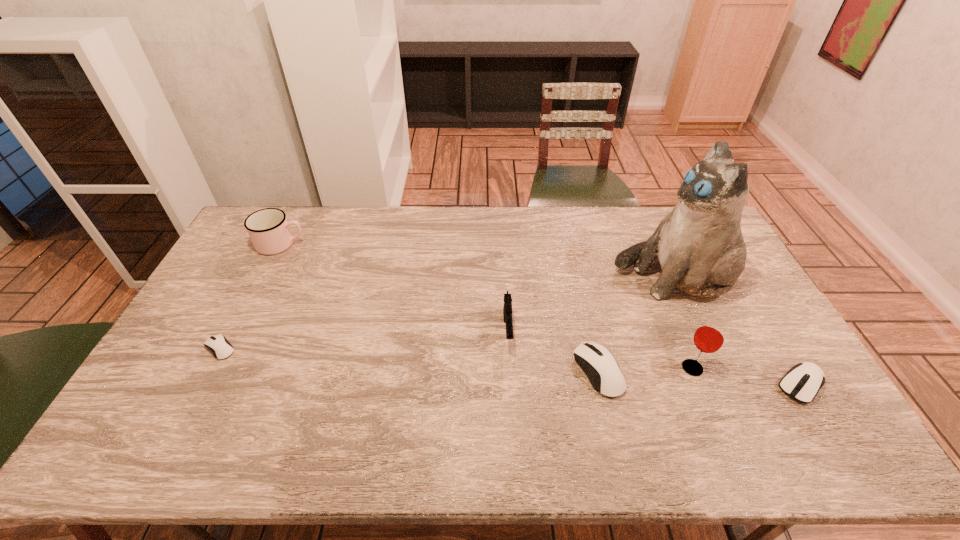
Where is `empty space that is in between the rightmost mouse and the fourth object from left to right`? The height and width of the screenshot is (540, 960). empty space that is in between the rightmost mouse and the fourth object from left to right is located at coordinates (700, 379).

Where is `free point between the second shortest object and the tallest object`? free point between the second shortest object and the tallest object is located at coordinates (737, 330).

The height and width of the screenshot is (540, 960). I want to click on vacant area that lies between the second mouse from right to left and the third object from left to right, so click(553, 352).

Identify the location of free spot between the second mouse from right to left and the sixth shortest object. Image resolution: width=960 pixels, height=540 pixels. (645, 370).

Where is `free space between the second shortest mouse and the shortest object`? free space between the second shortest mouse and the shortest object is located at coordinates (511, 367).

Where is `free space between the glass and the second tallest mouse`? free space between the glass and the second tallest mouse is located at coordinates (747, 376).

The width and height of the screenshot is (960, 540). What are the coordinates of `free area in between the fourth object from left to right and the fifth object from right to left` in the screenshot? It's located at (553, 352).

Find the location of a particular element. This screenshot has width=960, height=540. free area in between the mug and the shortest mouse is located at coordinates (251, 296).

Where is `empty space that is in between the pistol and the mug`? empty space that is in between the pistol and the mug is located at coordinates (395, 288).

Locate which object ranks third in proximity to the cat. Please provide its 2D coordinates. Your answer should be formatted as a tuple, i.e. [(x, y)], where the tuple contains the x and y coordinates of a point satisfying the conditions above.

[(802, 382)]